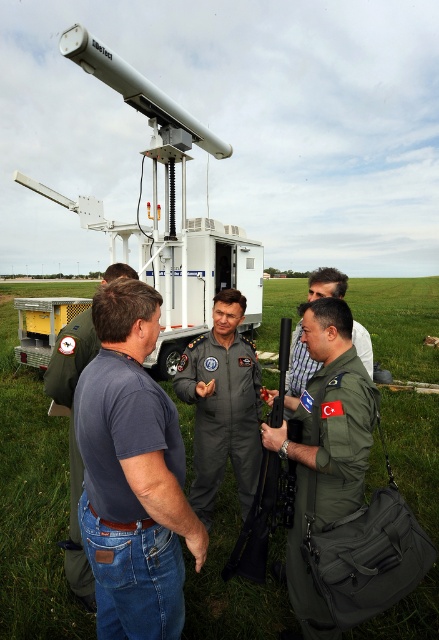
Does dark blue t-shirt at center have a greater height compared to blue denim jeans at lower left?

No, dark blue t-shirt at center is not taller than blue denim jeans at lower left.

Is dark blue t-shirt at center thinner than blue denim jeans at lower left?

Indeed, dark blue t-shirt at center has a lesser width compared to blue denim jeans at lower left.

Image resolution: width=439 pixels, height=640 pixels. What do you see at coordinates (133, 474) in the screenshot? I see `dark blue t-shirt at center` at bounding box center [133, 474].

Locate an element on the screen. This screenshot has width=439, height=640. dark blue t-shirt at center is located at coordinates (133, 474).

Between dark gray uniform at center and yellow mesh trailer truck at lower left, which one has less height?

With less height is yellow mesh trailer truck at lower left.

Does dark gray uniform at center appear under yellow mesh trailer truck at lower left?

Indeed, dark gray uniform at center is positioned under yellow mesh trailer truck at lower left.

Where is `dark gray uniform at center`? Image resolution: width=439 pixels, height=640 pixels. dark gray uniform at center is located at coordinates (223, 404).

Does dark gray uniform at center appear under blue denim jeans at lower left?

Yes, dark gray uniform at center is below blue denim jeans at lower left.

Between dark gray uniform at center and blue denim jeans at lower left, which one appears on the left side from the viewer's perspective?

Positioned to the left is blue denim jeans at lower left.

Which is behind, point (219, 406) or point (47, 365)?

Positioned behind is point (219, 406).

At what (x,y) coordinates should I click in order to perform the action: click on dark gray uniform at center. Please return your answer as a coordinate pair (x, y). Looking at the image, I should click on (223, 404).